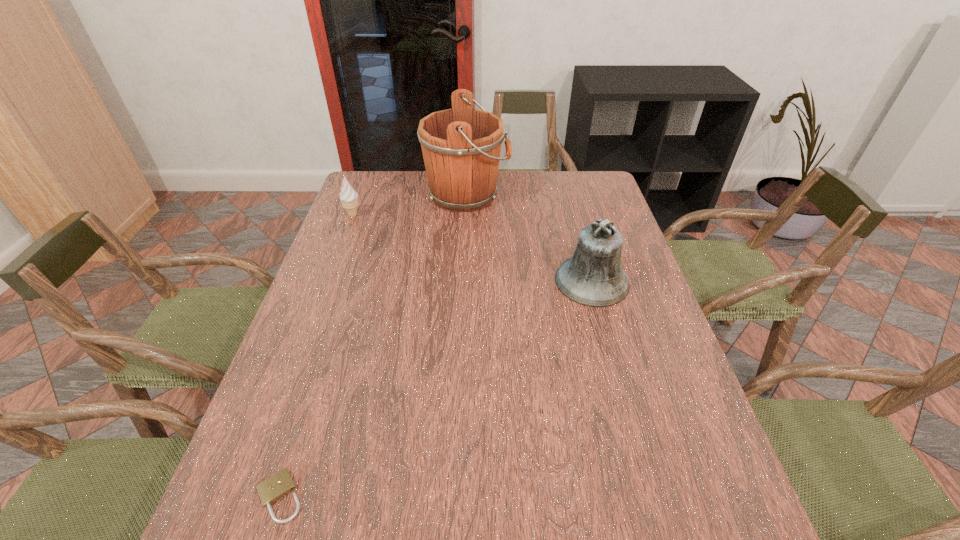
Locate an element on the screen. free space between the icecream and the shortest object is located at coordinates point(316,356).

You are a GUI agent. You are given a task and a screenshot of the screen. Output one action in this format:
    pyautogui.click(x=<x>, y=<y>)
    Task: Click on the free space that is in between the bucket and the third shortest object
    Image resolution: width=960 pixels, height=540 pixels.
    Given the screenshot: What is the action you would take?
    pyautogui.click(x=529, y=238)

At what (x,y) coordinates should I click in order to perform the action: click on vacant area that lies between the icecream and the third object from left to right. Please return your answer as a coordinate pair (x, y). The width and height of the screenshot is (960, 540). Looking at the image, I should click on point(410,205).

In order to click on unoccupied position between the second tallest object and the nearest object in this screenshot , I will do `click(436, 389)`.

The width and height of the screenshot is (960, 540). I want to click on empty space between the icecream and the padlock, so click(x=316, y=356).

This screenshot has height=540, width=960. I want to click on free space between the icecream and the rightmost object, so click(x=472, y=248).

You are a GUI agent. You are given a task and a screenshot of the screen. Output one action in this format:
    pyautogui.click(x=<x>, y=<y>)
    Task: Click on the vacant point located between the tallest object and the shortest object
    
    Given the screenshot: What is the action you would take?
    pyautogui.click(x=373, y=346)

The height and width of the screenshot is (540, 960). What are the coordinates of `free spot between the tallest object and the padlock` in the screenshot? It's located at (373, 346).

The image size is (960, 540). Find the location of `free spot between the third farthest object and the second object from right to left`. free spot between the third farthest object and the second object from right to left is located at coordinates (529, 238).

Locate which object is the closest to the third object from left to right. Please provide its 2D coordinates. Your answer should be formatted as a tuple, i.e. [(x, y)], where the tuple contains the x and y coordinates of a point satisfying the conditions above.

[(349, 197)]